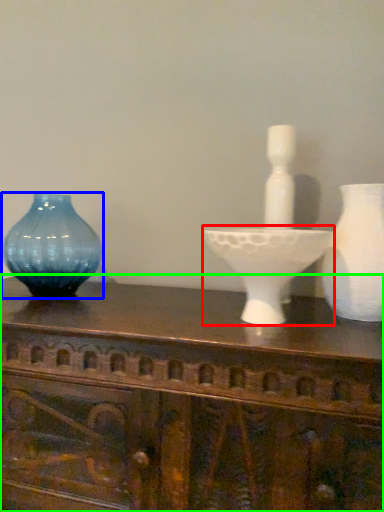
Question: Estimate the real-world distances between objects in this image. Which object is farther from candle holder (highlighted by a red box), vase (highlighted by a blue box) or table (highlighted by a green box)?

Choices:
 (A) vase
 (B) table

Answer: (A)